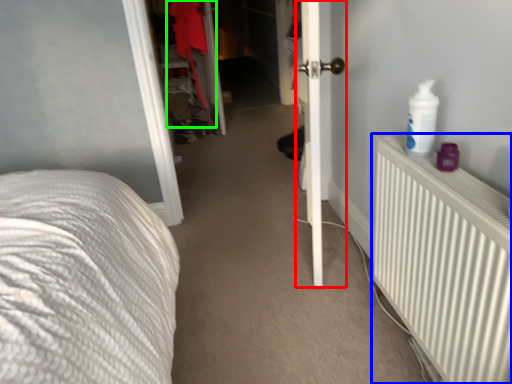
Question: Which object is positioned closest to door (highlighted by a red box)? Select from radiator (highlighted by a blue box) and clothing (highlighted by a green box).

Choices:
 (A) radiator
 (B) clothing

Answer: (A)